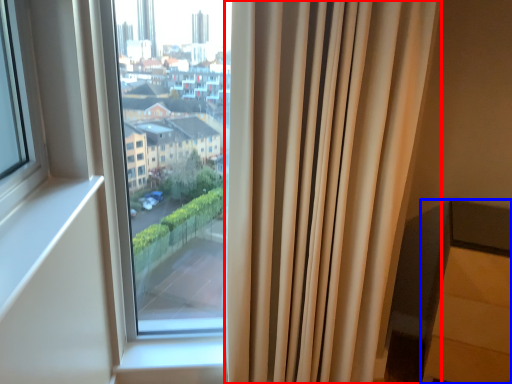
Question: Which object is further to the camera taking this photo, curtain (highlighted by a red box) or furniture (highlighted by a blue box)?

Choices:
 (A) curtain
 (B) furniture

Answer: (B)